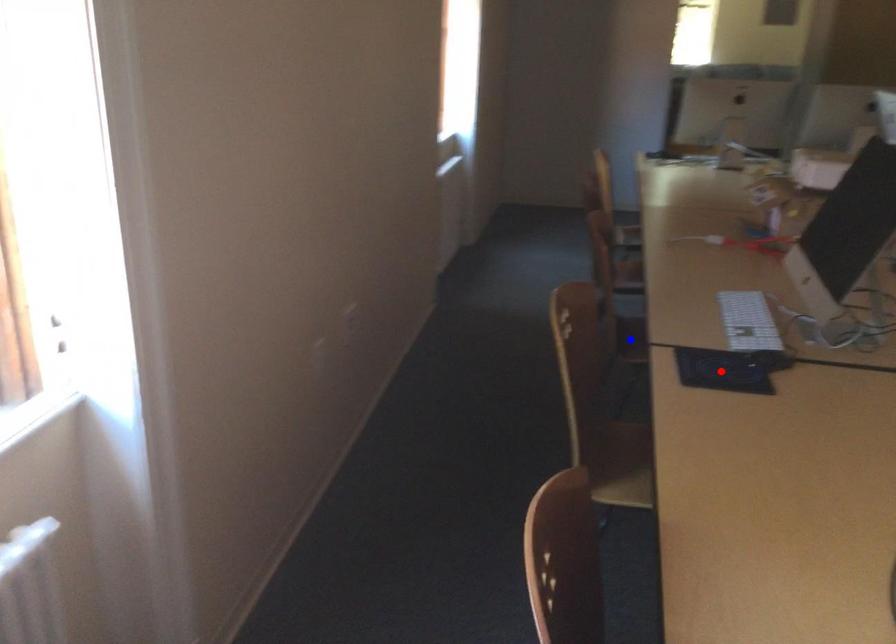
Question: In the image, two points are highlighted. Which point is nearer to the camera? Reply with the corresponding letter.

Choices:
 (A) blue point
 (B) red point

Answer: (B)